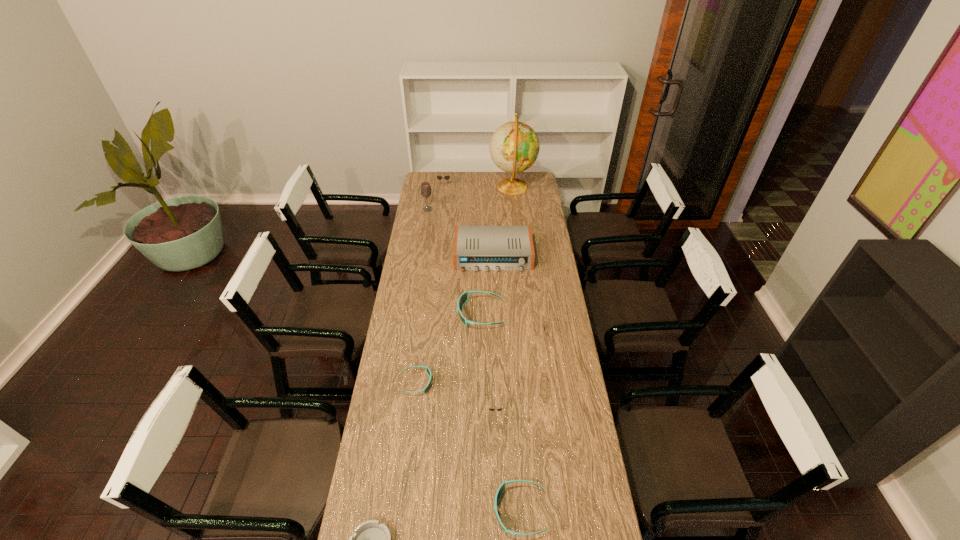
This screenshot has width=960, height=540. What are the coordinates of `globe` in the screenshot? It's located at (514, 147).

Where is `glass drink container`? Image resolution: width=960 pixels, height=540 pixels. glass drink container is located at coordinates (426, 191).

Where is `the ninth shortest object`? The width and height of the screenshot is (960, 540). the ninth shortest object is located at coordinates (426, 191).

Where is `the farthest black sunglasses`? the farthest black sunglasses is located at coordinates [438, 177].

The width and height of the screenshot is (960, 540). I want to click on the biggest black sunglasses, so click(438, 177).

This screenshot has width=960, height=540. Find the location of `radio receiver`. radio receiver is located at coordinates (476, 248).

Identify the location of the second nearest black sunglasses. The height and width of the screenshot is (540, 960). (546, 317).

Where is `the second biggest black sunglasses`? the second biggest black sunglasses is located at coordinates (546, 317).

Where is `the farthest cyan sunglasses`? The height and width of the screenshot is (540, 960). the farthest cyan sunglasses is located at coordinates (463, 298).

Where is `the nearest black sunglasses`? This screenshot has width=960, height=540. the nearest black sunglasses is located at coordinates (491, 409).